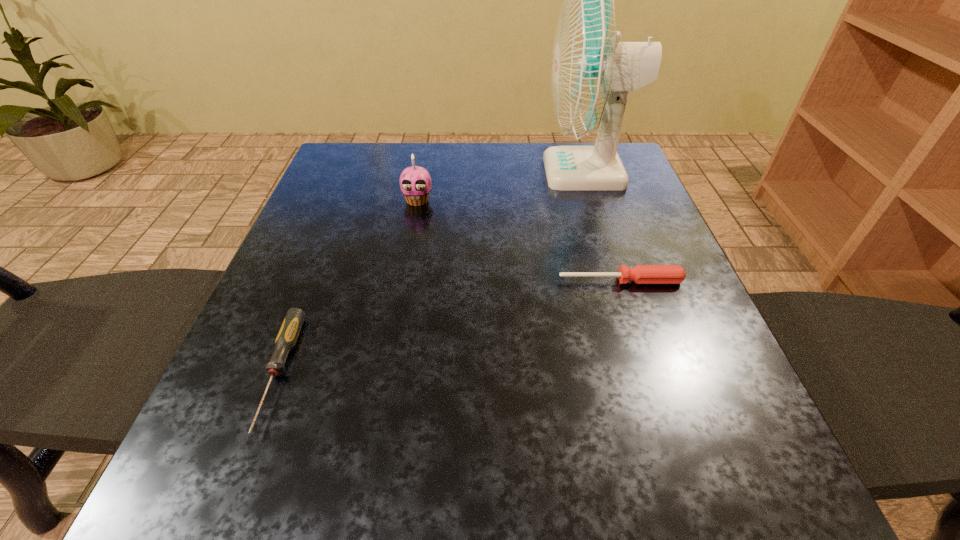
This screenshot has height=540, width=960. I want to click on free spot located 0.280m on the face of the cupcake, so click(x=399, y=302).

Find the location of a particular element. This screenshot has height=540, width=960. free point located 0.340m on the left of the second nearest object is located at coordinates (373, 281).

Locate an element on the screen. fan present at the far edge is located at coordinates (592, 72).

Where is `cupcake that is at the far edge`? Image resolution: width=960 pixels, height=540 pixels. cupcake that is at the far edge is located at coordinates (415, 182).

Identify the location of object that is positioned at the left edge. Image resolution: width=960 pixels, height=540 pixels. (286, 339).

Locate an element on the screen. The height and width of the screenshot is (540, 960). fan that is positioned at the right edge is located at coordinates (592, 72).

I want to click on screwdriver that is positioned at the right edge, so click(641, 274).

You are a GUI agent. You are given a task and a screenshot of the screen. Output one action in this format:
    pyautogui.click(x=<x>, y=<y>)
    Task: Click on the object that is positioned at the far right corner
    This screenshot has width=960, height=540.
    Given the screenshot: What is the action you would take?
    pyautogui.click(x=592, y=72)

At what (x,y) coordinates should I click in order to perform the action: click on free region at the far edge of the desktop. Please return your answer as a coordinate pair (x, y). This screenshot has height=540, width=960. Looking at the image, I should click on (484, 164).

The width and height of the screenshot is (960, 540). In the image, there is a desktop. Find the location of `vacant region at the near edge`. vacant region at the near edge is located at coordinates (584, 509).